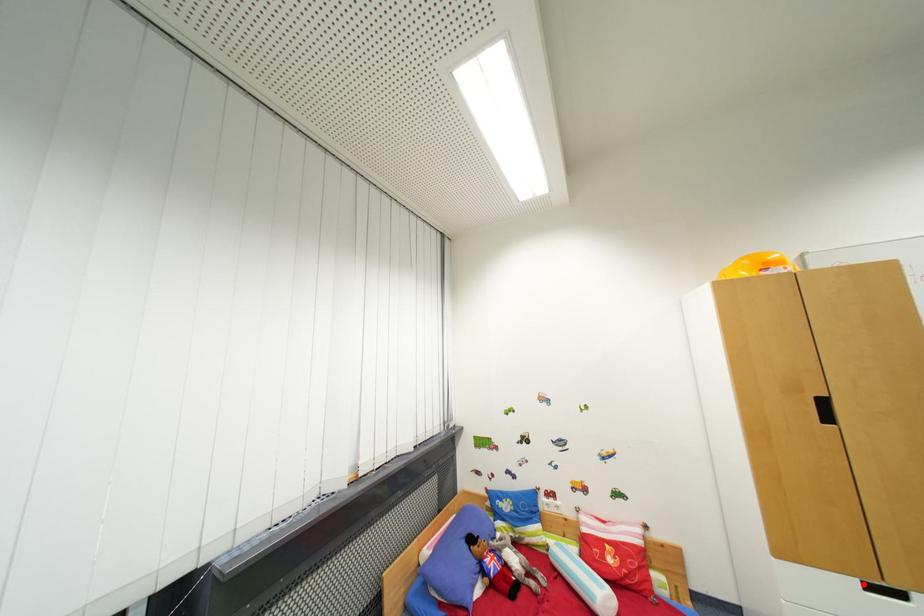
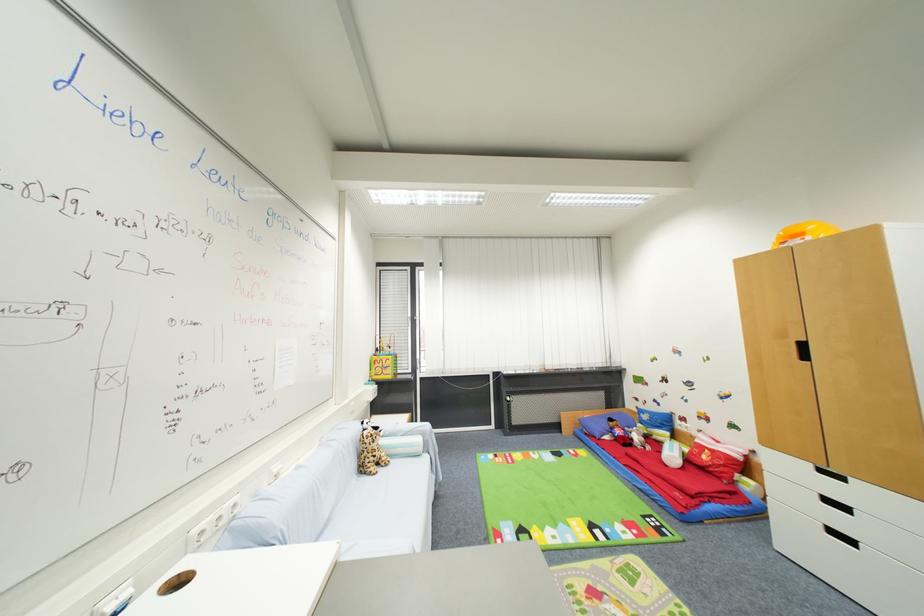
Where in the second image is the point corresponding to the highlighted location from the first image?

(816, 467)